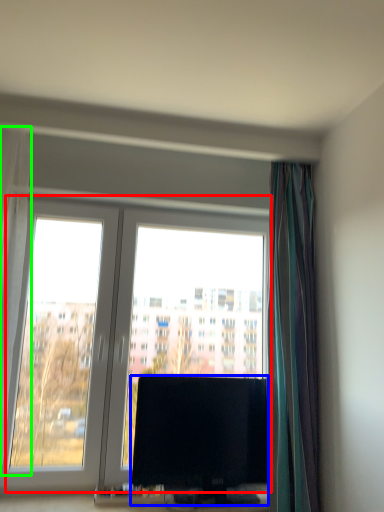
Question: Which is farther away from window (highlighted by a red box)? television (highlighted by a blue box) or curtain (highlighted by a green box)?

Choices:
 (A) television
 (B) curtain

Answer: (B)